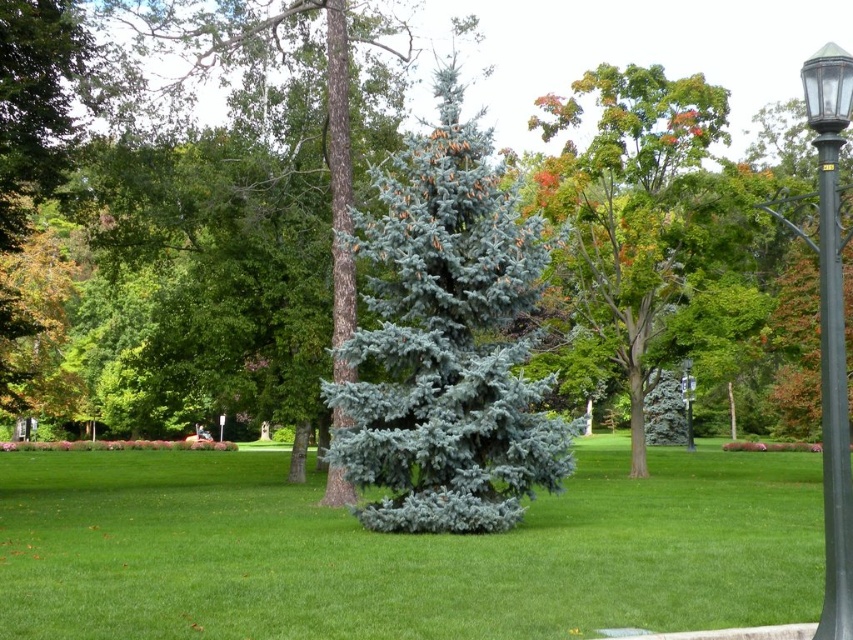
Does green grass at center come behind polished metal street light at center right?

That is False.

Looking at this image, does green grass at center have a lesser height compared to polished metal street light at center right?

Correct, green grass at center is not as tall as polished metal street light at center right.

Is point (45, 538) in front of point (686, 394)?

That is True.

Locate an element on the screen. green grass at center is located at coordinates (399, 552).

Locate an element on the screen. green grass at center is located at coordinates (399, 552).

Does green grass at center have a lesser width compared to black metal street light at right?

No, green grass at center is not thinner than black metal street light at right.

Which is in front, point (734, 508) or point (850, 70)?

Positioned in front is point (850, 70).

Find the location of a particular element. green grass at center is located at coordinates (399, 552).

Is black metal street light at right above black glass lamp post at right?

Yes.

This screenshot has width=853, height=640. What do you see at coordinates (830, 326) in the screenshot?
I see `black metal street light at right` at bounding box center [830, 326].

The width and height of the screenshot is (853, 640). Find the location of `black metal street light at right`. black metal street light at right is located at coordinates (830, 326).